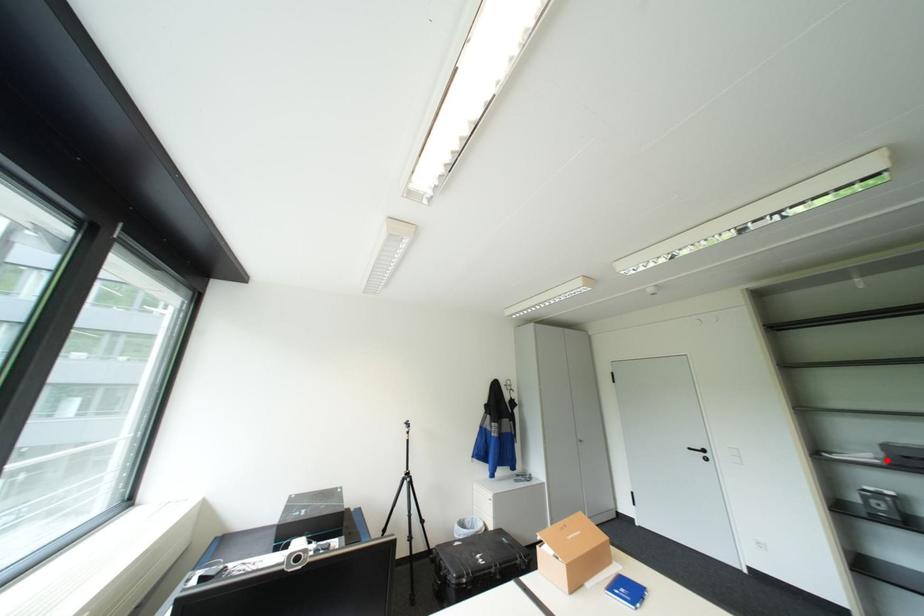
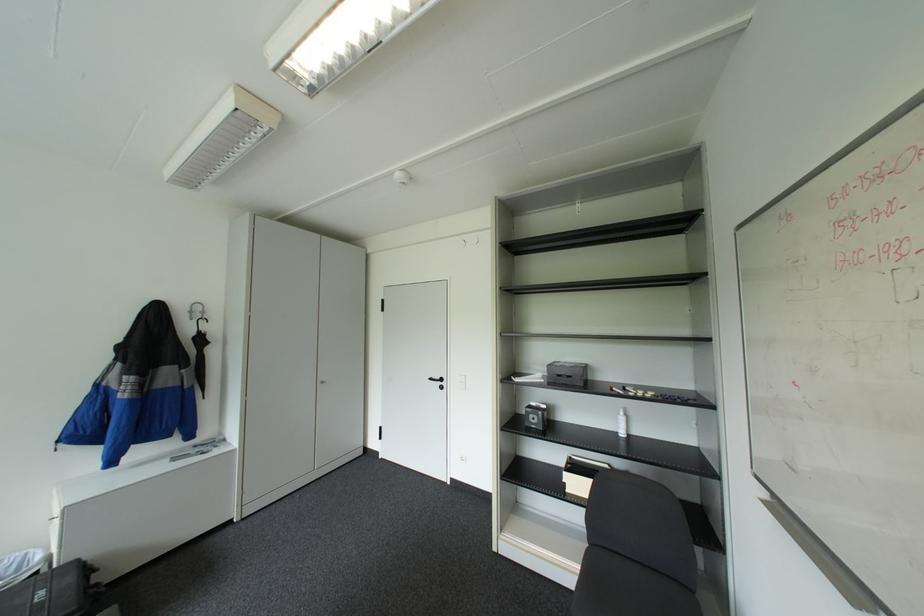
Question: A red point is marked in image1. In image2, is the corresponding 3D point closer to the camera or farther? Reply with the corresponding letter.

Choices:
 (A) The corresponding 3D point is closer.
 (B) The corresponding 3D point is farther.

Answer: (B)